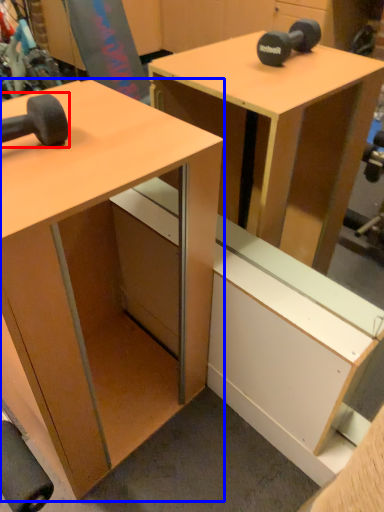
Question: Which of the following is the closest to the observer, dumbbell (highlighted by a red box) or desk (highlighted by a blue box)?

Choices:
 (A) dumbbell
 (B) desk

Answer: (B)